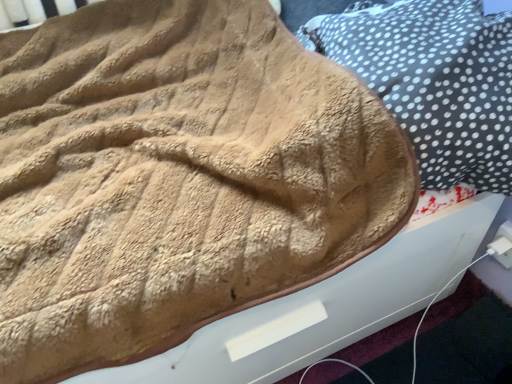
Question: Is white plastic plug at lower right taller or shorter than beige fuzzy pillow at upper right?

Choices:
 (A) tall
 (B) short

Answer: (B)

Question: Considering the positions of point (506, 238) and point (478, 72), is point (506, 238) closer or farther from the camera than point (478, 72)?

Choices:
 (A) closer
 (B) farther

Answer: (B)

Question: In the image, is white plastic plug at lower right on the left side or the right side of beige fuzzy pillow at upper right?

Choices:
 (A) right
 (B) left

Answer: (A)

Question: Visually, is beige fuzzy pillow at upper right positioned to the left or to the right of white plastic plug at lower right?

Choices:
 (A) right
 (B) left

Answer: (B)

Question: Is beige fuzzy pillow at upper right taller or shorter than white plastic plug at lower right?

Choices:
 (A) tall
 (B) short

Answer: (A)

Question: From the image's perspective, is beige fuzzy pillow at upper right above or below white plastic plug at lower right?

Choices:
 (A) above
 (B) below

Answer: (A)

Question: In terms of size, does beige fuzzy pillow at upper right appear bigger or smaller than white plastic plug at lower right?

Choices:
 (A) small
 (B) big

Answer: (B)